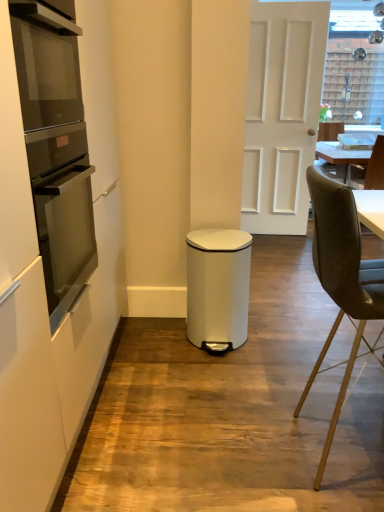
At what (x,y) coordinates should I click in order to perform the action: click on free space in front of white matte waste bin at center. Please return your answer as a coordinate pair (x, y). The height and width of the screenshot is (512, 384). Looking at the image, I should click on (228, 375).